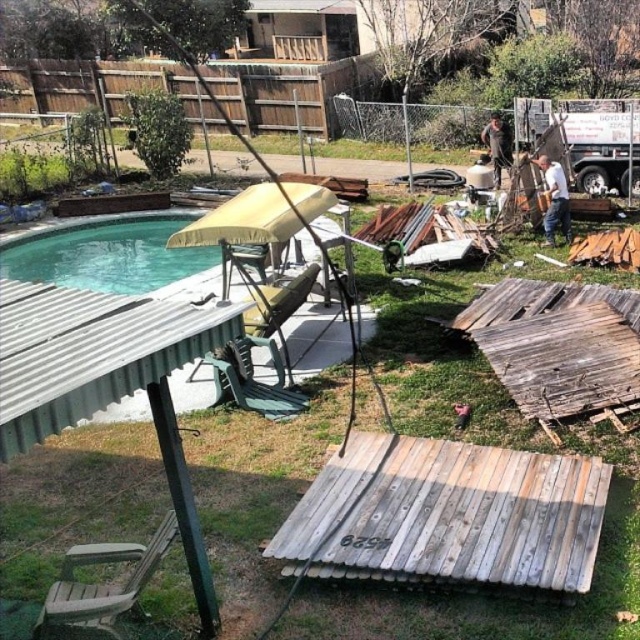
Question: Which point is farther to the camera?

Choices:
 (A) white matte shirt at upper right
 (B) green plastic pool at center
 (C) green grass at center

Answer: (B)

Question: Can you confirm if green plastic pool at center is bigger than white matte shirt at upper right?

Choices:
 (A) no
 (B) yes

Answer: (B)

Question: Is green grass at center further to the viewer compared to white matte shirt at upper right?

Choices:
 (A) yes
 (B) no

Answer: (B)

Question: Can you confirm if green grass at center is wider than white matte shirt at upper right?

Choices:
 (A) no
 (B) yes

Answer: (A)

Question: Which object is the farthest from the white matte shirt at upper right?

Choices:
 (A) brown leather jacket at upper right
 (B) green grass at center
 (C) green plastic pool at center

Answer: (B)

Question: Which object is farther from the camera taking this photo?

Choices:
 (A) brown leather jacket at upper right
 (B) green grass at center

Answer: (A)